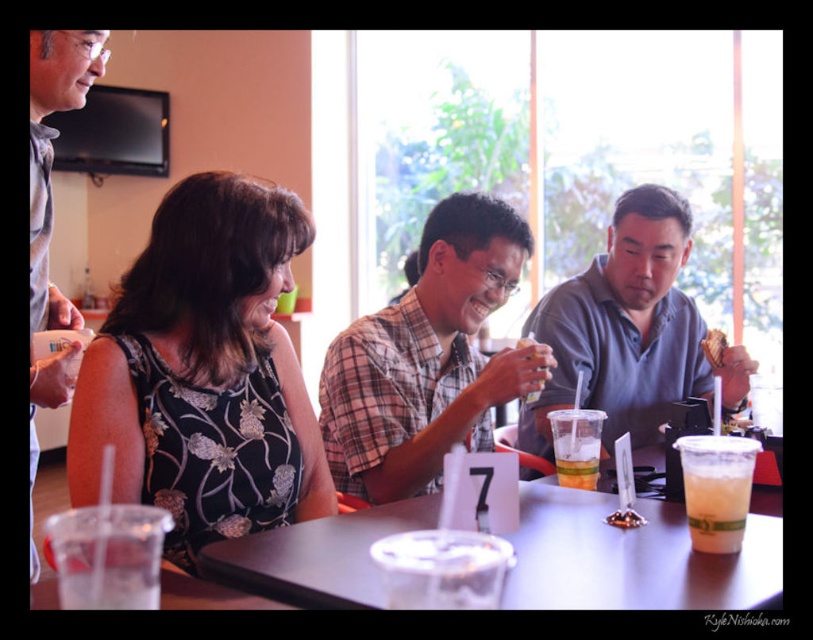
You are a customer at table 7 and want to grab both items at point (403, 308) and point (494, 580). Which item should you reach for first to minimize the distance you have to move your hand?

You should reach for the point at (403, 308) first because it is closer to you than the point at (494, 580) since it is further away.

You are a waiter in a restaurant and you need to deliver a drink to the customer wearing the gray cotton shirt at right. You are currently standing at the entrance of the restaurant, which is 2 meters away from the table with the white card numbered 7. Can you reach the customer without moving past the table with the white card numbered 7?

The gray cotton shirt at right is 1.93 meters away from the viewer. Since the entrance is 2 meters away from the table numbered 7, the distance between the viewer and the table is slightly less than the distance to the customer. Therefore, you can reach the customer without moving past the table numbered 7 as the shirt is closer than the table distance.